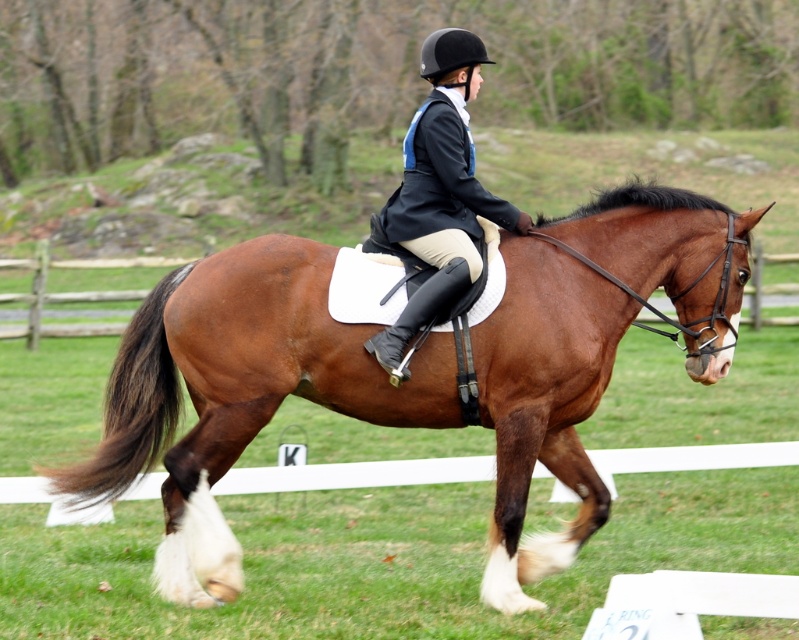
Question: Does brown glossy horse at center appear on the left side of brown silky tail at lower left?

Choices:
 (A) no
 (B) yes

Answer: (A)

Question: Which of the following is the farthest from the observer?

Choices:
 (A) (173, 368)
 (B) (646, 276)

Answer: (B)

Question: Can you confirm if brown glossy horse at center is thinner than brown silky tail at lower left?

Choices:
 (A) no
 (B) yes

Answer: (A)

Question: Can you confirm if brown glossy horse at center is positioned to the left of brown silky tail at lower left?

Choices:
 (A) yes
 (B) no

Answer: (B)